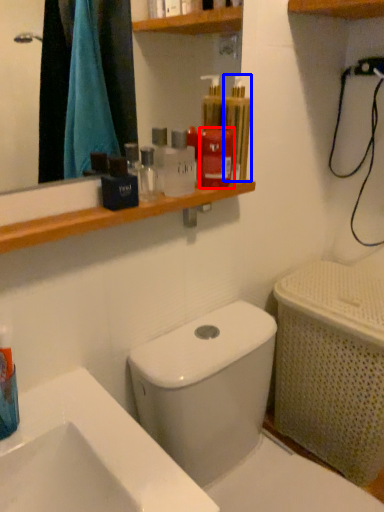
Question: Among these objects, which one is farthest to the camera, mouthwash (highlighted by a red box) or mouthwash (highlighted by a blue box)?

Choices:
 (A) mouthwash
 (B) mouthwash

Answer: (A)